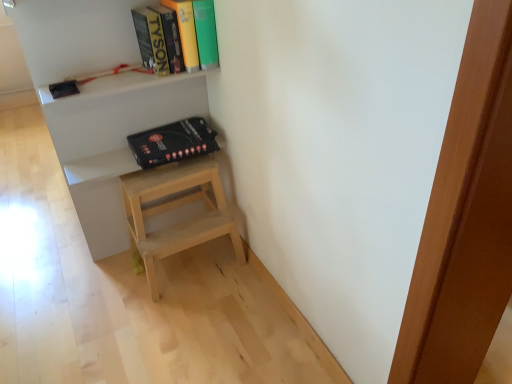
The width and height of the screenshot is (512, 384). Identify the location of hardcover book at upper center. (194, 31).

Where is `hardcover book at upper center`? This screenshot has height=384, width=512. hardcover book at upper center is located at coordinates (194, 31).

How different are the orientations of white matte shelf at upper center and black matte box at upper center in degrees?

They differ by 8.2 degrees in their facing directions.

Measure the distance between white matte shelf at upper center and black matte box at upper center.

white matte shelf at upper center is 9.00 inches away from black matte box at upper center.

From the picture: Is white matte shelf at upper center not within black matte box at upper center?

white matte shelf at upper center lies outside black matte box at upper center's area.

Is white matte shelf at upper center oriented towards black matte box at upper center?

Yes, white matte shelf at upper center faces towards black matte box at upper center.

From the image's perspective, does black matte box at upper center appear lower than white matte shelf at upper center?

Yes, from the image's perspective, black matte box at upper center is below white matte shelf at upper center.

At what (x,y) coordinates should I click in order to perform the action: click on shelf in front of the black matte box at upper center. Please return your answer as a coordinate pair (x, y). Image resolution: width=512 pixels, height=384 pixels. Looking at the image, I should click on (99, 102).

Considering the sizes of objects black matte box at upper center and white matte shelf at upper center in the image provided, who is shorter, black matte box at upper center or white matte shelf at upper center?

Standing shorter between the two is black matte box at upper center.

Looking at this image, in the image, is black matte box at upper center on the left side or the right side of white matte shelf at upper center?

black matte box at upper center is to the right of white matte shelf at upper center.

From the picture: Which of these two, hardcover book at upper center or white matte shelf at upper center, is smaller?

hardcover book at upper center.

At what (x,y) coordinates should I click in order to perform the action: click on book above the white matte shelf at upper center (from the image's perspective). Please return your answer as a coordinate pair (x, y). Looking at the image, I should click on (194, 31).

Is white matte shelf at upper center located within hardcover book at upper center?

No, hardcover book at upper center does not contain white matte shelf at upper center.

From the image's perspective, is hardcover book at upper center above or below white matte shelf at upper center?

From the image's perspective, hardcover book at upper center appears above white matte shelf at upper center.

Image resolution: width=512 pixels, height=384 pixels. I want to click on paperback book lying behind the hardcover book at upper center, so click(173, 142).

Looking at the image, does black matte box at upper center seem bigger or smaller compared to hardcover book at upper center?

black matte box at upper center is smaller than hardcover book at upper center.

From a real-world perspective, is black matte box at upper center physically located above or below hardcover book at upper center?

From a real-world perspective, black matte box at upper center is physically below hardcover book at upper center.

From the image's perspective, between black matte box at upper center and hardcover book at upper center, who is located below?

From the image's view, black matte box at upper center is below.

At what (x,y) coordinates should I click in order to perform the action: click on book above the white matte shelf at upper center (from the image's perspective). Please return your answer as a coordinate pair (x, y). Looking at the image, I should click on (194, 31).

Choose the correct answer: Is white matte shelf at upper center inside hardcover book at upper center or outside it?

white matte shelf at upper center cannot be found inside hardcover book at upper center.

Does point (123, 215) appear closer or farther from the camera than point (214, 29)?

Clearly, point (123, 215) is more distant from the camera than point (214, 29).

From the picture: Is hardcover book at upper center thinner than black matte box at upper center?

Indeed, hardcover book at upper center has a lesser width compared to black matte box at upper center.

From the image's perspective, is hardcover book at upper center positioned above or below black matte box at upper center?

hardcover book at upper center is above black matte box at upper center.

In the image, is hardcover book at upper center positioned in front of or behind black matte box at upper center?

In the image, hardcover book at upper center appears in front of black matte box at upper center.

Where is `paperback book on the right of the white matte shelf at upper center`? paperback book on the right of the white matte shelf at upper center is located at coordinates (173, 142).

Find the location of a particular element. shelf on the left of black matte box at upper center is located at coordinates (99, 102).

From the image, which object appears to be nearer to white matte shelf at upper center, hardcover book at upper center or black matte box at upper center?

black matte box at upper center lies closer to white matte shelf at upper center than the other object.

Which object lies nearer to the anchor point hardcover book at upper center, black matte box at upper center or white matte shelf at upper center?

black matte box at upper center is closer to hardcover book at upper center.

Estimate the real-world distances between objects in this image. Which object is closer to black matte box at upper center, white matte shelf at upper center or hardcover book at upper center?

white matte shelf at upper center lies closer to black matte box at upper center than the other object.

From the image, which object appears to be farther from black matte box at upper center, hardcover book at upper center or white matte shelf at upper center?

hardcover book at upper center.

Looking at the image, which one is located further to white matte shelf at upper center, black matte box at upper center or hardcover book at upper center?

Among the two, hardcover book at upper center is located further to white matte shelf at upper center.

Which object lies nearer to the anchor point hardcover book at upper center, white matte shelf at upper center or black matte box at upper center?

Among the two, black matte box at upper center is located nearer to hardcover book at upper center.

Image resolution: width=512 pixels, height=384 pixels. I want to click on shelf between hardcover book at upper center and black matte box at upper center vertically, so click(99, 102).